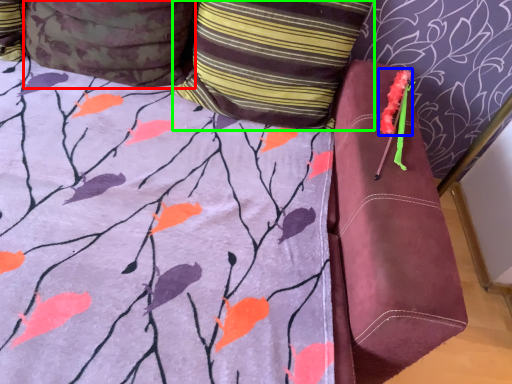
Question: Estimate the real-world distances between objects in this image. Which object is farther from pillow (highlighted by a red box), flower (highlighted by a blue box) or pillow (highlighted by a green box)?

Choices:
 (A) flower
 (B) pillow

Answer: (A)